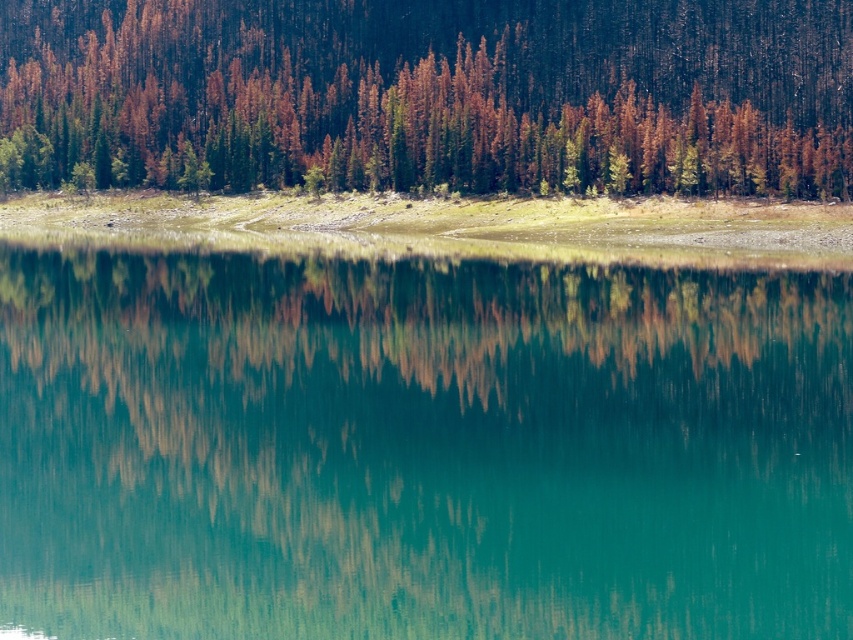
Question: Which point is closer to the camera?

Choices:
 (A) (233, 333)
 (B) (531, 106)

Answer: (A)

Question: Is the position of green glassy water at center less distant than that of brown/dried wood trees at upper center?

Choices:
 (A) no
 (B) yes

Answer: (B)

Question: Does green glassy water at center have a greater width compared to brown/dried wood trees at upper center?

Choices:
 (A) no
 (B) yes

Answer: (A)

Question: Is green glassy water at center further to the viewer compared to brown/dried wood trees at upper center?

Choices:
 (A) yes
 (B) no

Answer: (B)